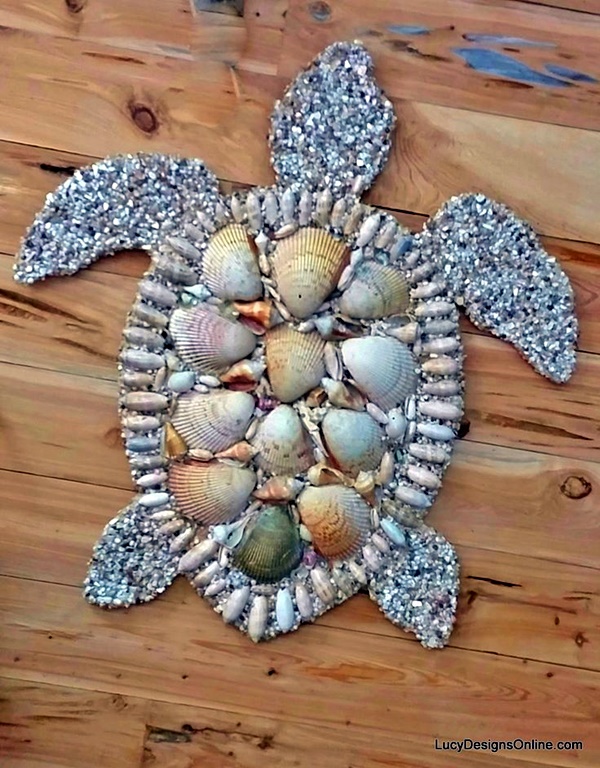
Where is `wood panels`? The image size is (600, 768). wood panels is located at coordinates (532, 511), (539, 626), (518, 706), (187, 733), (572, 425), (592, 288), (572, 171), (374, 12).